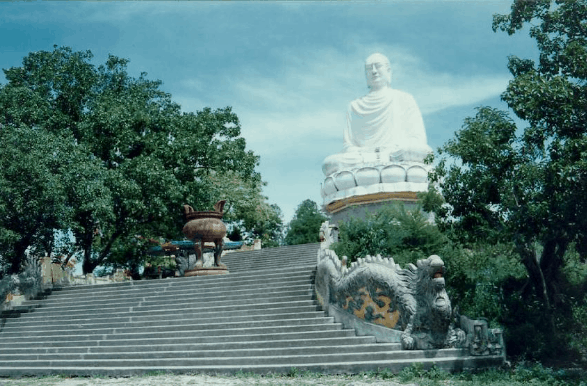
At what (x,y) coordinates should I click in order to perform the action: click on bowl. Please return your answer as a coordinate pair (x, y). Looking at the image, I should click on [x=203, y=228].